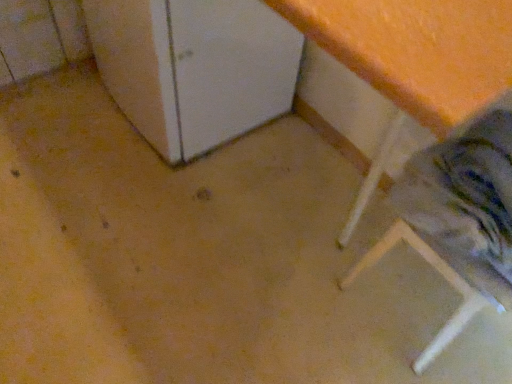
Question: Would you say wooden step stool at lower right is inside or outside white matte cabinet at upper left?

Choices:
 (A) outside
 (B) inside

Answer: (A)

Question: From their relative heights in the image, would you say wooden step stool at lower right is taller or shorter than white matte cabinet at upper left?

Choices:
 (A) short
 (B) tall

Answer: (A)

Question: Is wooden step stool at lower right in front of or behind white matte cabinet at upper left in the image?

Choices:
 (A) front
 (B) behind

Answer: (A)

Question: Is point (185, 9) closer or farther from the camera than point (459, 266)?

Choices:
 (A) closer
 (B) farther

Answer: (B)

Question: Which is correct: white matte cabinet at upper left is inside wooden step stool at lower right, or outside of it?

Choices:
 (A) outside
 (B) inside

Answer: (A)

Question: In the image, is white matte cabinet at upper left positioned in front of or behind wooden step stool at lower right?

Choices:
 (A) behind
 (B) front

Answer: (A)

Question: Is white matte cabinet at upper left wider or thinner than wooden step stool at lower right?

Choices:
 (A) thin
 (B) wide

Answer: (B)